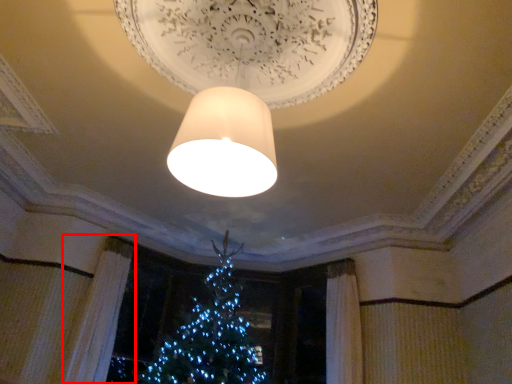
Question: Considering the relative positions of curtain (annotated by the red box) and lamp in the image provided, where is curtain (annotated by the red box) located with respect to the staircase?

Choices:
 (A) right
 (B) left

Answer: (B)